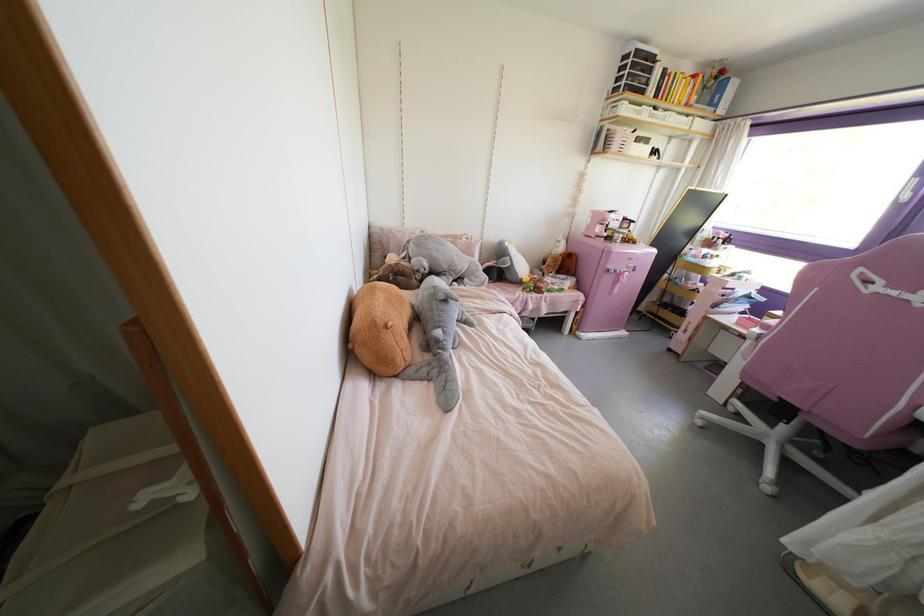
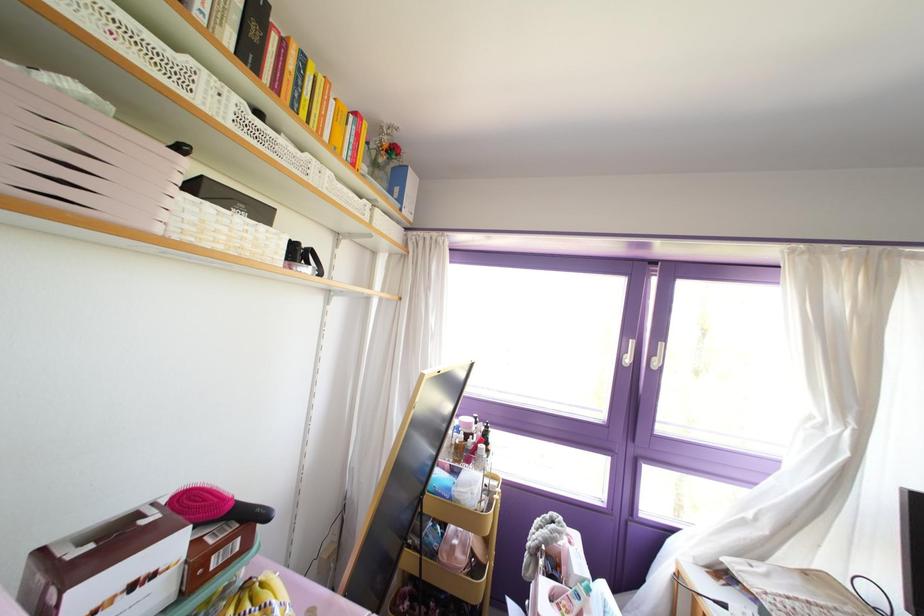
The point at (703, 87) is marked in the first image. Where is the corresponding point in the second image?

(372, 163)